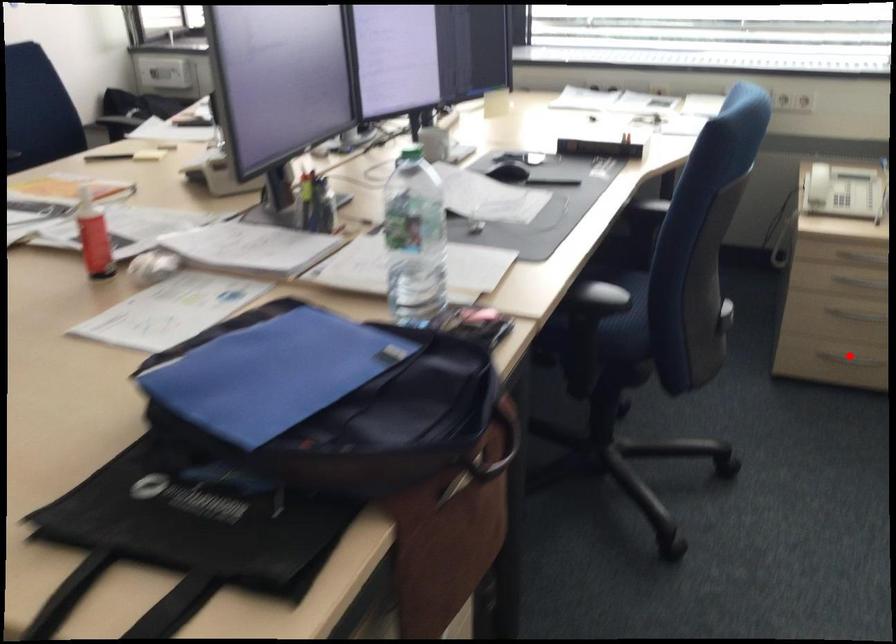
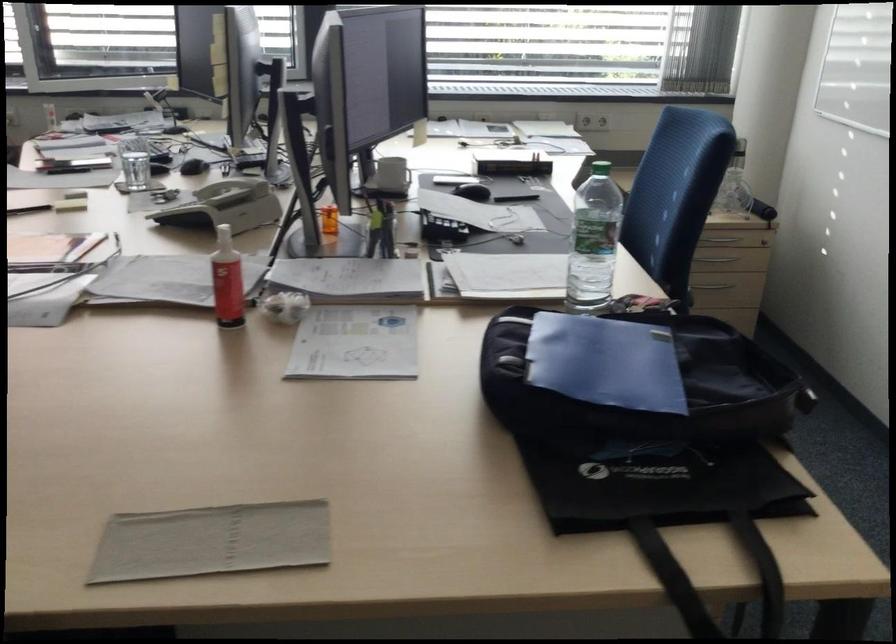
Question: I am providing you with two images of the same scene from different viewpoints. A red point is marked on the first image. At the location where the point appears in image 1, is it still visible in image 2?

Choices:
 (A) Yes
 (B) No

Answer: (B)